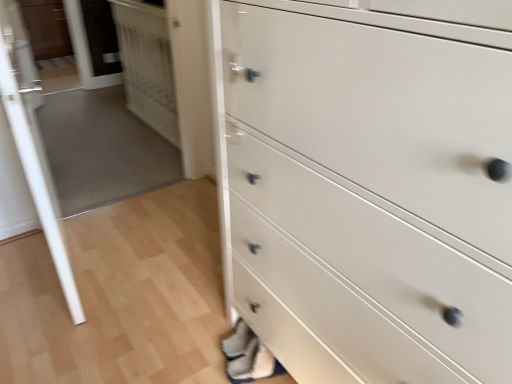
Question: Is transparent glass door at upper left, positioned as the 2th glass door in front-to-back order, to the right of transparent glass door at left, which appears as the 2th glass door when viewed from the back, from the viewer's perspective?

Choices:
 (A) yes
 (B) no

Answer: (A)

Question: Does transparent glass door at upper left, the 1th glass door from the back, have a smaller size compared to transparent glass door at left, the first glass door viewed from the front?

Choices:
 (A) yes
 (B) no

Answer: (A)

Question: Is transparent glass door at left, which appears as the 2th glass door when viewed from the back, a part of transparent glass door at upper left, positioned as the 2th glass door in front-to-back order?

Choices:
 (A) yes
 (B) no

Answer: (B)

Question: From the image's perspective, is transparent glass door at upper left, positioned as the 2th glass door in front-to-back order, beneath transparent glass door at left, the first glass door viewed from the front?

Choices:
 (A) yes
 (B) no

Answer: (B)

Question: Is transparent glass door at upper left, the 1th glass door from the back, wider than transparent glass door at left, which appears as the 2th glass door when viewed from the back?

Choices:
 (A) no
 (B) yes

Answer: (A)

Question: Does transparent glass door at upper left, the 1th glass door from the back, have a greater height compared to transparent glass door at left, which appears as the 2th glass door when viewed from the back?

Choices:
 (A) yes
 (B) no

Answer: (B)

Question: Is white glossy door at upper left facing towards matte brown cabinet at upper left?

Choices:
 (A) yes
 (B) no

Answer: (B)

Question: From the image's perspective, is white glossy door at upper left located beneath matte brown cabinet at upper left?

Choices:
 (A) no
 (B) yes

Answer: (B)

Question: Is white glossy door at upper left bigger than matte brown cabinet at upper left?

Choices:
 (A) no
 (B) yes

Answer: (B)

Question: Considering the relative sizes of white glossy door at upper left and matte brown cabinet at upper left in the image provided, is white glossy door at upper left shorter than matte brown cabinet at upper left?

Choices:
 (A) no
 (B) yes

Answer: (A)

Question: Considering the relative positions of white glossy door at upper left and matte brown cabinet at upper left in the image provided, is white glossy door at upper left to the right of matte brown cabinet at upper left from the viewer's perspective?

Choices:
 (A) no
 (B) yes

Answer: (B)

Question: Is matte brown cabinet at upper left completely or partially inside white glossy door at upper left?

Choices:
 (A) no
 (B) yes

Answer: (A)

Question: Is the surface of matte brown cabinet at upper left in direct contact with transparent glass door at upper left, the 1th glass door from the back?

Choices:
 (A) yes
 (B) no

Answer: (B)